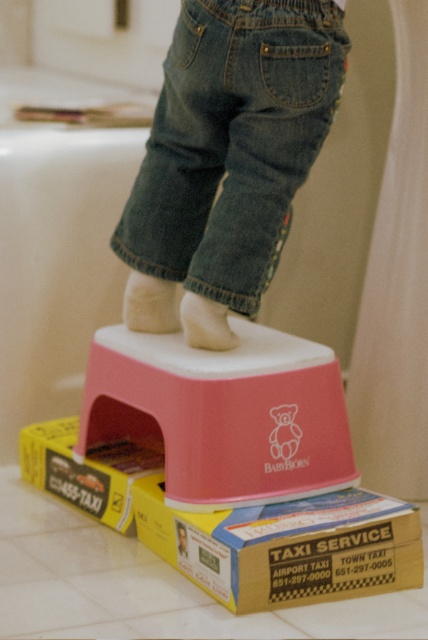
You are a parent trying to ensure the child can safely reach the sink. The sink is located 1.2 meters away from where you are standing. If the point marked as point (347,577) represents the child standing on the pink step stool, can the child reach the sink?

The distance between point (347,577) and the viewer is 1.12 meters. Since the sink is 1.2 meters away from the parent, the child is closer to the sink than the parent. Therefore, the child can reach the sink.

You are a delivery person trying to place a package on the yellow cardboard box at lower center and the yellow cardboard box at lower left. Which box should you choose if you want to place the package closer to the child?

The yellow cardboard box at lower center is closer to the viewer than the yellow cardboard box at lower left, so placing the package on the yellow cardboard box at lower center would make it closer to the child.